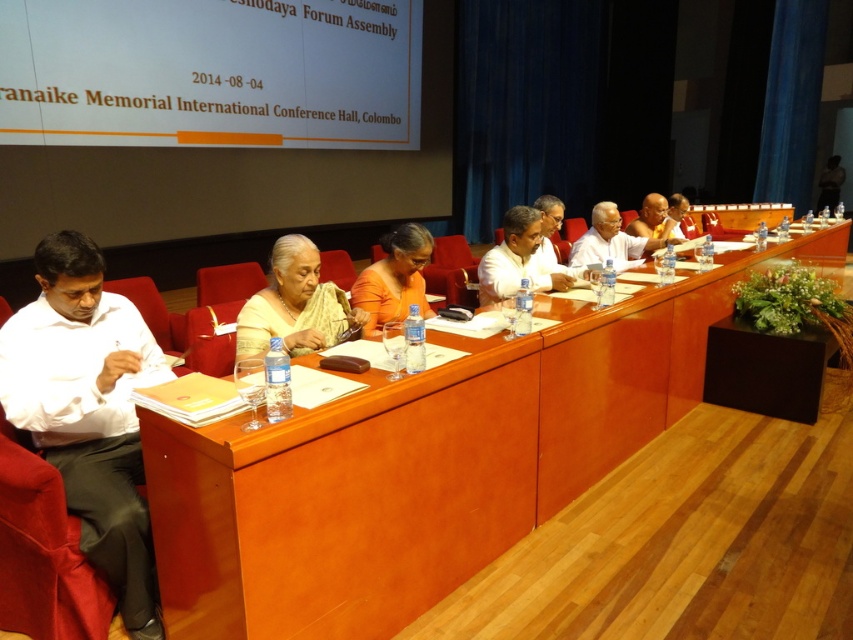
Question: Is white fabric shirt at center wider than matte white shirt at upper right?

Choices:
 (A) yes
 (B) no

Answer: (B)

Question: Based on their relative distances, which object is farther from the matte white shirt at upper right?

Choices:
 (A) black fabric person at upper right
 (B) orange fabric saree at center
 (C) satin yellow saree at center
 (D) white glossy shirt at center

Answer: (A)

Question: Can you confirm if white cotton shirt at left is positioned to the left of white fabric shirt at center?

Choices:
 (A) no
 (B) yes

Answer: (B)

Question: Among these points, which one is nearest to the camera?

Choices:
 (A) (605, 228)
 (B) (48, 448)
 (C) (837, 179)

Answer: (B)

Question: Can you confirm if matte white shirt at upper right is thinner than black fabric person at upper right?

Choices:
 (A) no
 (B) yes

Answer: (A)

Question: Which of the following is the farthest from the observer?

Choices:
 (A) (663, 208)
 (B) (419, 276)
 (C) (575, 259)
 (D) (154, 630)

Answer: (A)